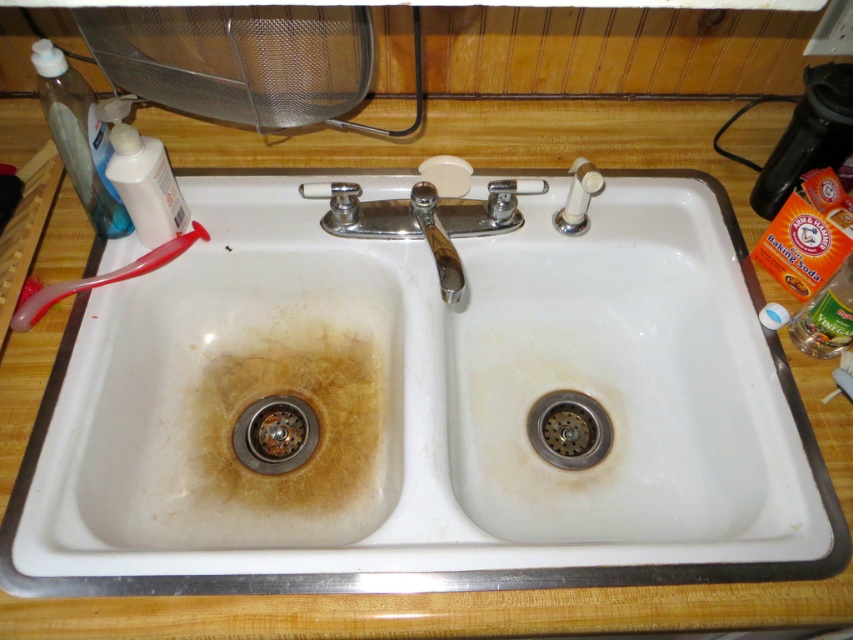
Which is more to the right, stainless steel drain at center or clear glass bottle at right?

From the viewer's perspective, clear glass bottle at right appears more on the right side.

Is point (566, 445) more distant than point (846, 262)?

Yes, it is.

I want to click on stainless steel drain at center, so click(x=569, y=429).

Which is more to the right, white ceramic sink at center or clear glass bottle at right?

clear glass bottle at right

Looking at this image, measure the distance between white ceramic sink at center and camera.

A distance of 59.09 centimeters exists between white ceramic sink at center and camera.

The height and width of the screenshot is (640, 853). Find the location of `white ceramic sink at center`. white ceramic sink at center is located at coordinates (436, 406).

Who is positioned more to the right, clear glass bottle at right or polished chrome faucet at center?

clear glass bottle at right is more to the right.

Can you confirm if clear glass bottle at right is positioned above polished chrome faucet at center?

Incorrect, clear glass bottle at right is not positioned above polished chrome faucet at center.

Describe the element at coordinates (827, 316) in the screenshot. I see `clear glass bottle at right` at that location.

You are a GUI agent. You are given a task and a screenshot of the screen. Output one action in this format:
    pyautogui.click(x=<x>, y=<y>)
    Task: Click on the clear glass bottle at right
    This screenshot has height=640, width=853.
    Given the screenshot: What is the action you would take?
    pyautogui.click(x=827, y=316)